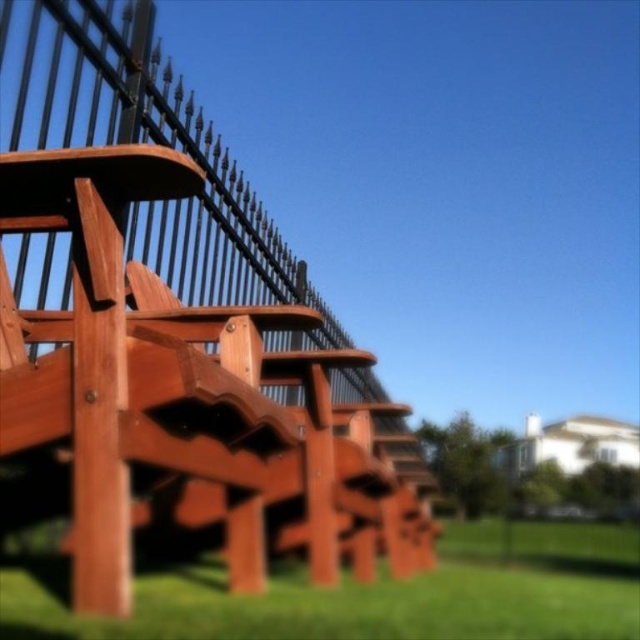
You are standing in the grassy area and want to take a photo of the brown wood fence at upper left. Which direction should you face to capture it in your camera view?

The brown wood fence at upper left is located at point (150,144) in the image, so you should face the upper left direction to capture it in your camera view.

You are standing in front of the row of Adirondack chairs and want to determine which of the two points, point (230,180) or point (550,605), is closer to you. Based on the scene, which point is nearer?

Point (230,180) is closer to you because it is further to the viewer than point (550,605).

Consider the image. You are standing at the camera position and want to place a 2.0 meter long ladder against the brown wood fence at upper left. Is there enough space between you and the fence to place the ladder?

The distance between the camera and the brown wood fence at upper left is 2.11 meters. Since the ladder is 2.0 meters long, there is sufficient space to place it against the fence.